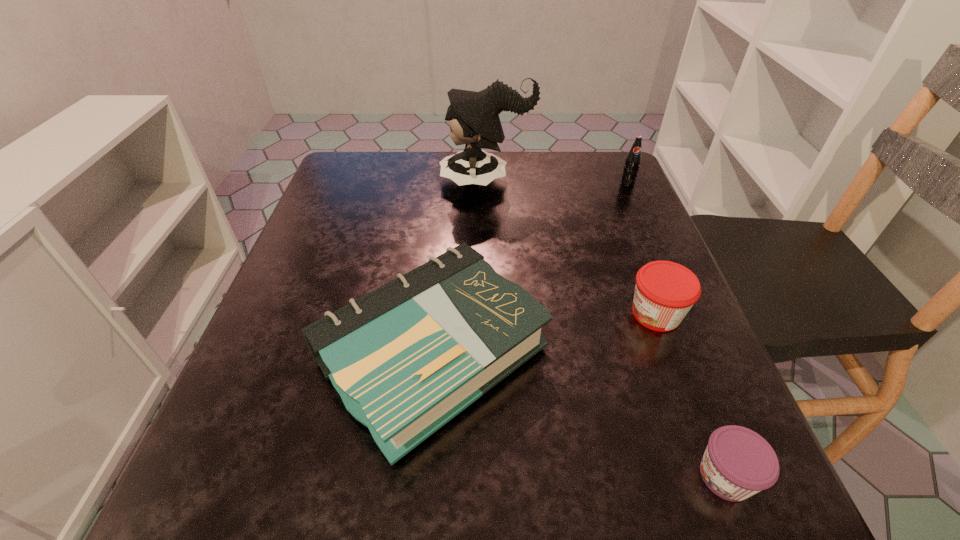
Find the location of a particular element. vacant region between the paperback book and the shortest object is located at coordinates (579, 415).

You are a GUI agent. You are given a task and a screenshot of the screen. Output one action in this format:
    pyautogui.click(x=<x>, y=<y>)
    Task: Click on the free space between the doll and the shortest object
    The image size is (960, 540).
    Given the screenshot: What is the action you would take?
    pyautogui.click(x=606, y=329)

In order to click on object that ranks as the second closest to the shorter jam in this screenshot , I will do `click(665, 291)`.

Find the location of a particular element. the second closest object relative to the paperback book is located at coordinates (738, 463).

Find the location of a particular element. The image size is (960, 540). free space that satisfies the following two spatial constraints: 1. on the front label of the second tallest object; 2. on the label side of the taller jam is located at coordinates (684, 314).